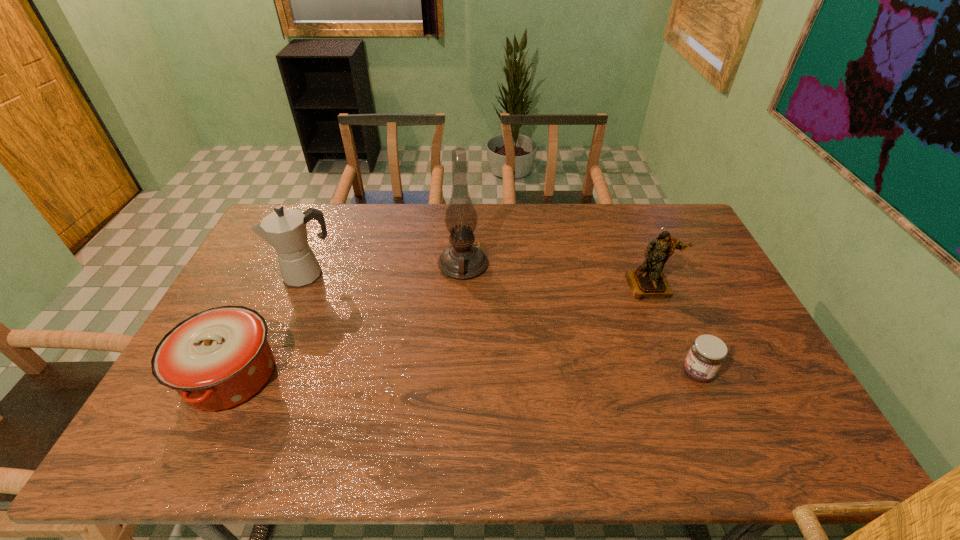
Locate an element on the screen. the third object from right to left is located at coordinates (462, 260).

The image size is (960, 540). I want to click on the tallest object, so click(462, 260).

This screenshot has width=960, height=540. I want to click on coffeepot, so click(x=284, y=229).

Where is `figurine`? The width and height of the screenshot is (960, 540). figurine is located at coordinates (648, 281).

Find the location of `casserole`. casserole is located at coordinates (216, 359).

You are a GUI agent. You are given a task and a screenshot of the screen. Output one action in this format:
    pyautogui.click(x=<x>, y=<y>)
    Task: Click on the jam
    The width and height of the screenshot is (960, 540).
    Given the screenshot: What is the action you would take?
    pyautogui.click(x=707, y=353)

At what (x,y) coordinates should I click in order to perform the action: click on free space located 0.350m on the left of the third object from right to left. Please return your answer as a coordinate pair (x, y). The width and height of the screenshot is (960, 540). Looking at the image, I should click on (334, 265).

Identify the location of free region located 0.070m on the front of the coffeepot. (294, 305).

Locate an element on the screen. This screenshot has width=960, height=540. free location located 0.180m on the front-facing side of the figurine is located at coordinates (675, 346).

Where is `vacant space located 0.180m on the right of the second shortest object`? vacant space located 0.180m on the right of the second shortest object is located at coordinates (348, 375).